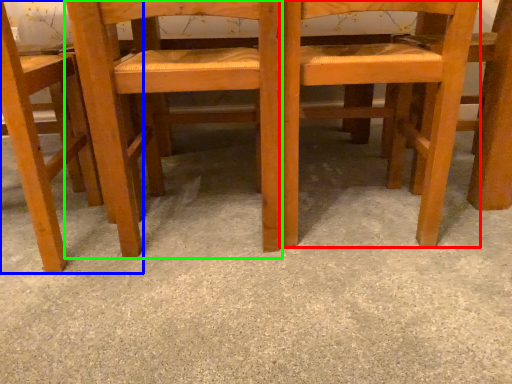
Question: Which object is positioned closest to chair (highlighted by a red box)? Select from chair (highlighted by a blue box) and chair (highlighted by a green box).

Choices:
 (A) chair
 (B) chair

Answer: (B)